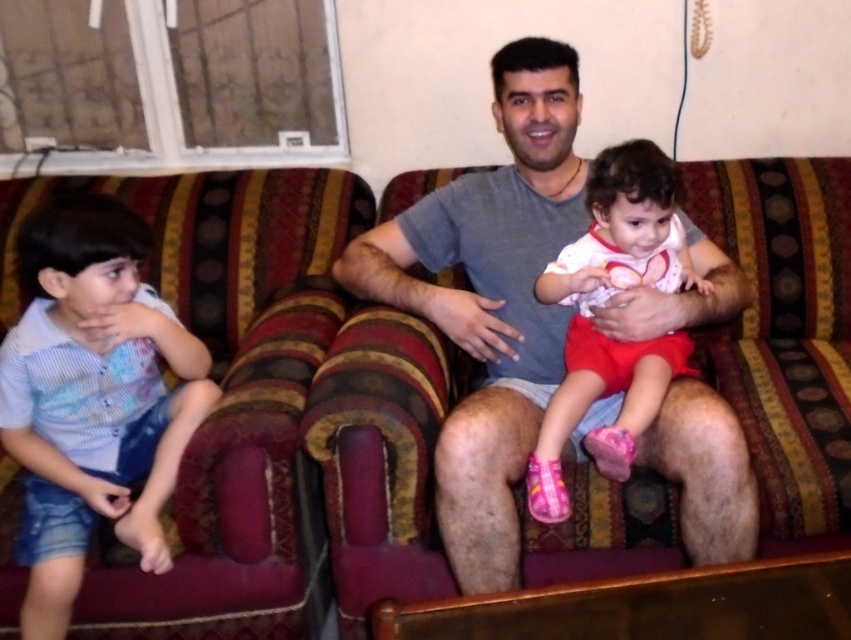
Does blue striped shirt at left appear under matte white shirt at center?

Correct, blue striped shirt at left is located below matte white shirt at center.

Can you confirm if blue striped shirt at left is wider than matte white shirt at center?

In fact, blue striped shirt at left might be narrower than matte white shirt at center.

Is point (3, 435) behind point (549, 403)?

No, it is in front of (549, 403).

You are a GUI agent. You are given a task and a screenshot of the screen. Output one action in this format:
    pyautogui.click(x=<x>, y=<y>)
    Task: Click on the blue striped shirt at left
    The image size is (851, 640).
    Given the screenshot: What is the action you would take?
    pyautogui.click(x=92, y=397)

Is point (487, 588) positioned after point (594, 211)?

No.

Is gray cotton shirt at center to the left of matte white shirt at center from the viewer's perspective?

Indeed, gray cotton shirt at center is positioned on the left side of matte white shirt at center.

The image size is (851, 640). What do you see at coordinates (490, 300) in the screenshot?
I see `gray cotton shirt at center` at bounding box center [490, 300].

Where is `gray cotton shirt at center`? gray cotton shirt at center is located at coordinates (490, 300).

The image size is (851, 640). Describe the element at coordinates (490, 300) in the screenshot. I see `gray cotton shirt at center` at that location.

Is the position of gray cotton shirt at center more distant than that of blue striped shirt at left?

Yes, gray cotton shirt at center is further from the viewer.

At what (x,y) coordinates should I click in order to perform the action: click on gray cotton shirt at center. Please return your answer as a coordinate pair (x, y). The image size is (851, 640). Looking at the image, I should click on (490, 300).

Locate an element on the screen. The width and height of the screenshot is (851, 640). gray cotton shirt at center is located at coordinates (490, 300).